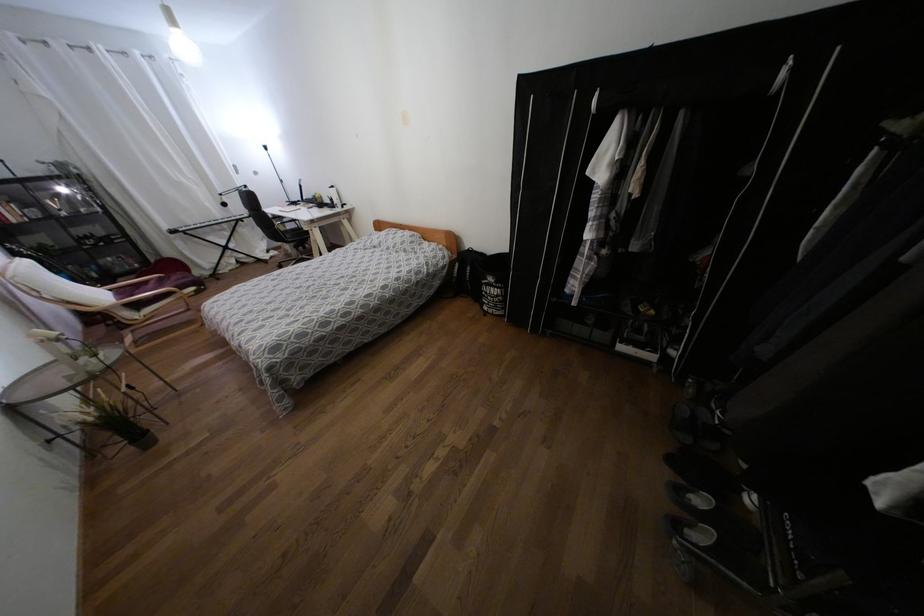
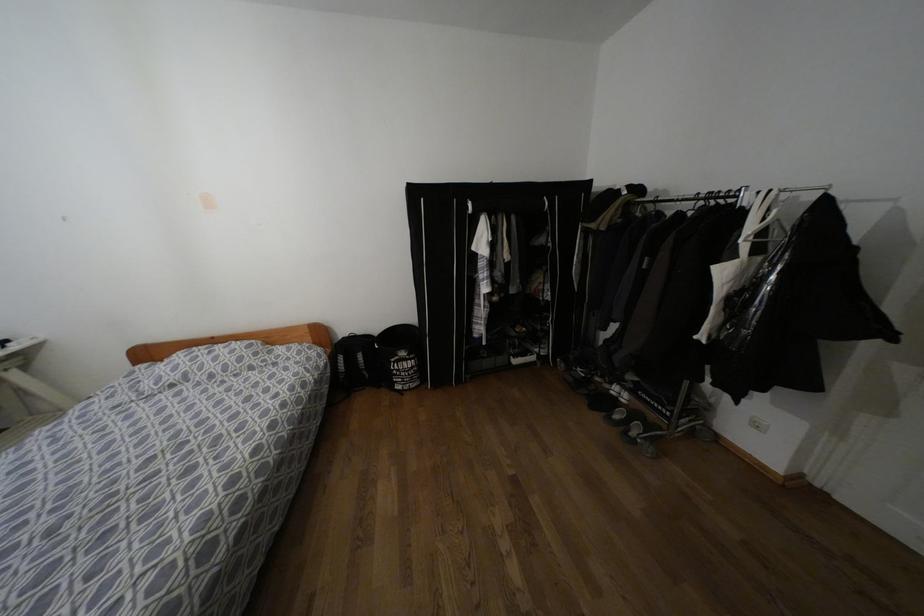
Question: Based on the continuous images, in which direction is the camera rotating? Reply with the corresponding letter.

Choices:
 (A) Left
 (B) Right
 (C) Up
 (D) Down

Answer: (B)